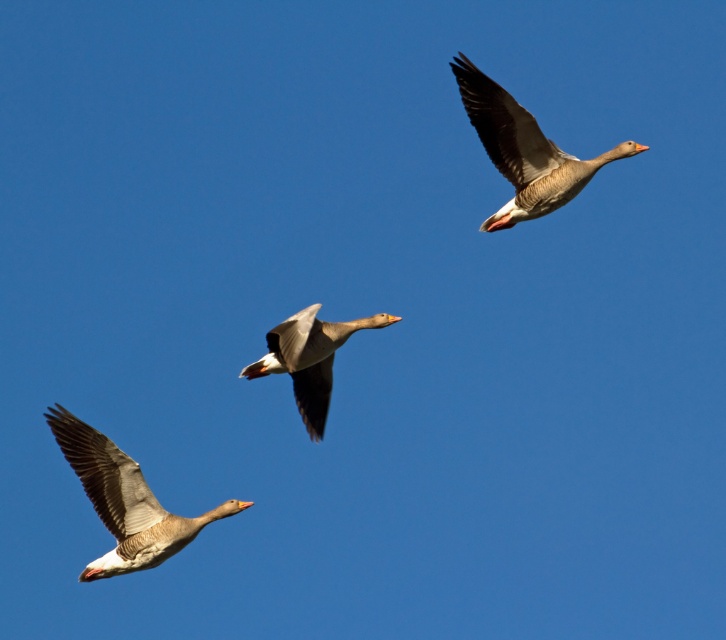
You are a wildlife photographer aiming to capture the largest goose in the image. You have two options in view, the gray matte goose at upper right and the gray matte goose at center. Which one should you focus on to ensure you photograph the wider goose?

The gray matte goose at upper right is wider than the gray matte goose at center, so you should focus on the gray matte goose at upper right to photograph the wider goose.

You are a photographer standing at the camera position. You want to capture a closeup shot of the gray matte goose at lower left. Considering the distance between you and the goose, can you use a standard 50mm lens to achieve this without cropping the image?

The gray matte goose at lower left is 206.95 feet away from the camera. A standard 50mm lens may not provide sufficient magnification to capture a closeup shot of the goose at this distance without cropping the image. A telephoto lens with a longer focal length would be more appropriate for this purpose.